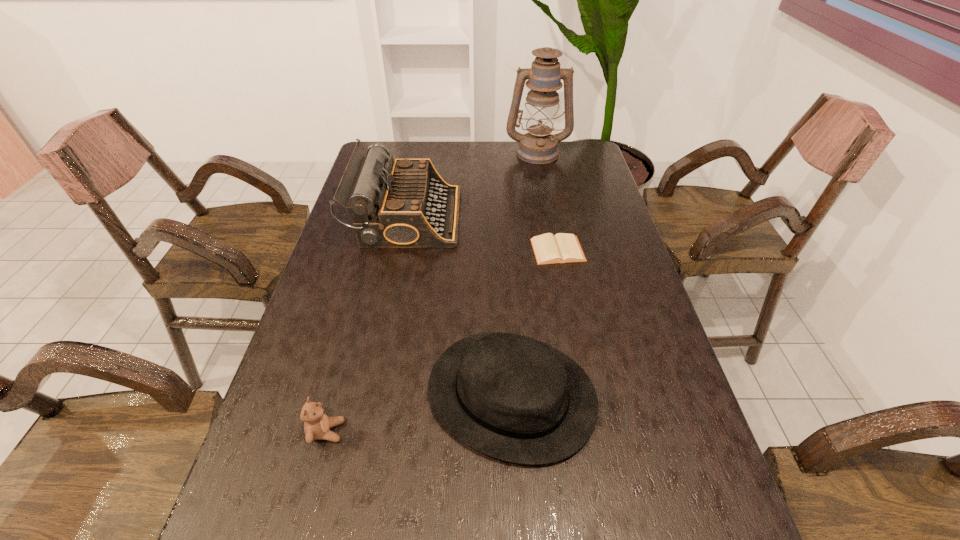
Image resolution: width=960 pixels, height=540 pixels. I want to click on vacant space situated on the back of the shortest object, so click(545, 184).

Where is `object positioned at the far edge`? The height and width of the screenshot is (540, 960). object positioned at the far edge is located at coordinates (539, 146).

Locate an element on the screen. typewriter that is at the left edge is located at coordinates (408, 205).

Where is `teddy bear located in the left edge section of the desktop`? teddy bear located in the left edge section of the desktop is located at coordinates click(317, 424).

Where is `oil lamp located in the right edge section of the desktop`? oil lamp located in the right edge section of the desktop is located at coordinates (539, 146).

This screenshot has height=540, width=960. Find the location of `diary that is at the right edge`. diary that is at the right edge is located at coordinates (561, 248).

Find the location of `object present at the far right corner`. object present at the far right corner is located at coordinates (539, 146).

This screenshot has height=540, width=960. I want to click on vacant space at the far edge, so click(530, 171).

In the image, there is a desktop. At what (x,y) coordinates should I click in order to perform the action: click on blank space at the right edge. Please return your answer as a coordinate pair (x, y). This screenshot has height=540, width=960. Looking at the image, I should click on (595, 242).

Image resolution: width=960 pixels, height=540 pixels. In the image, there is a desktop. Find the location of `vacant space at the far left corner`. vacant space at the far left corner is located at coordinates pyautogui.click(x=392, y=148).